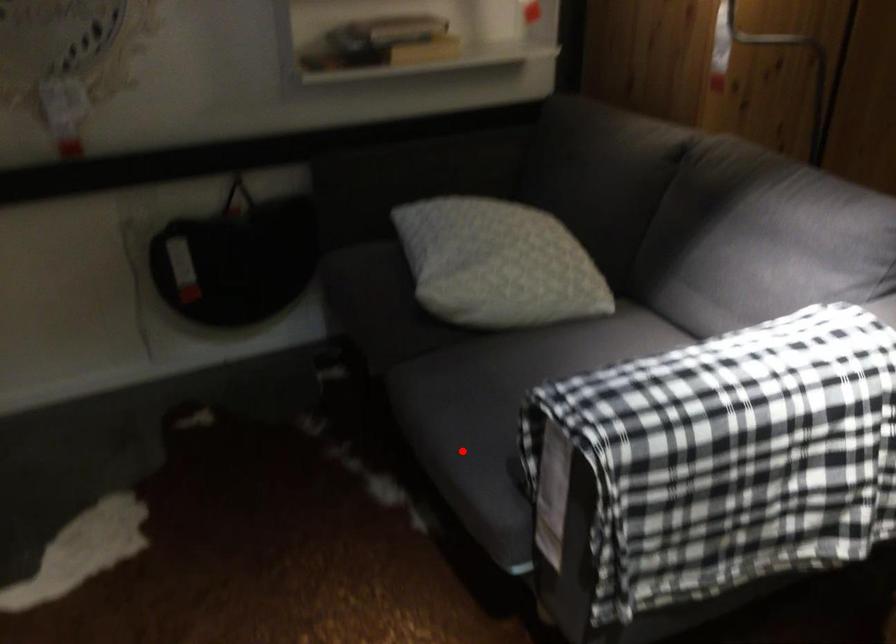
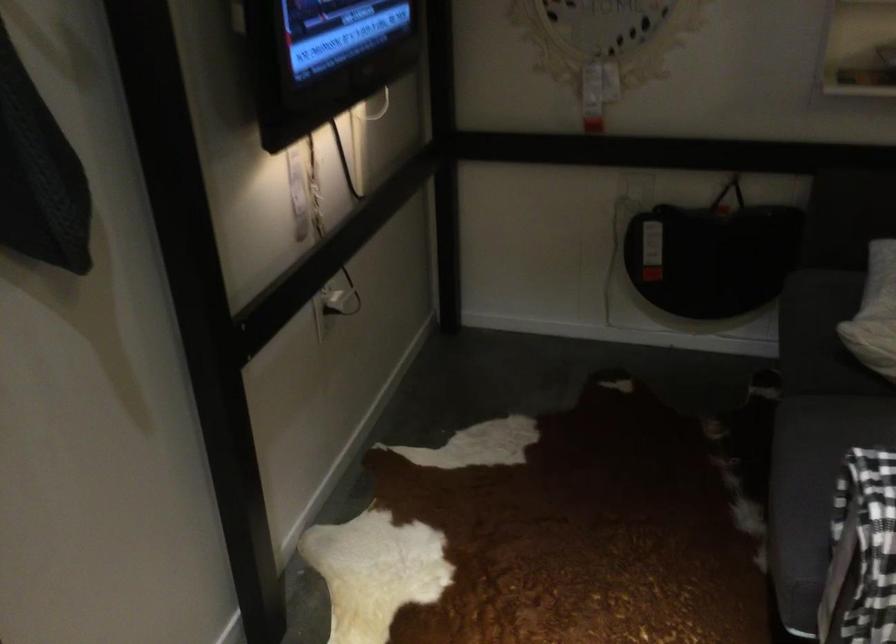
The point at the highlighted location is marked in the first image. Where is the corresponding point in the second image?

(805, 494)